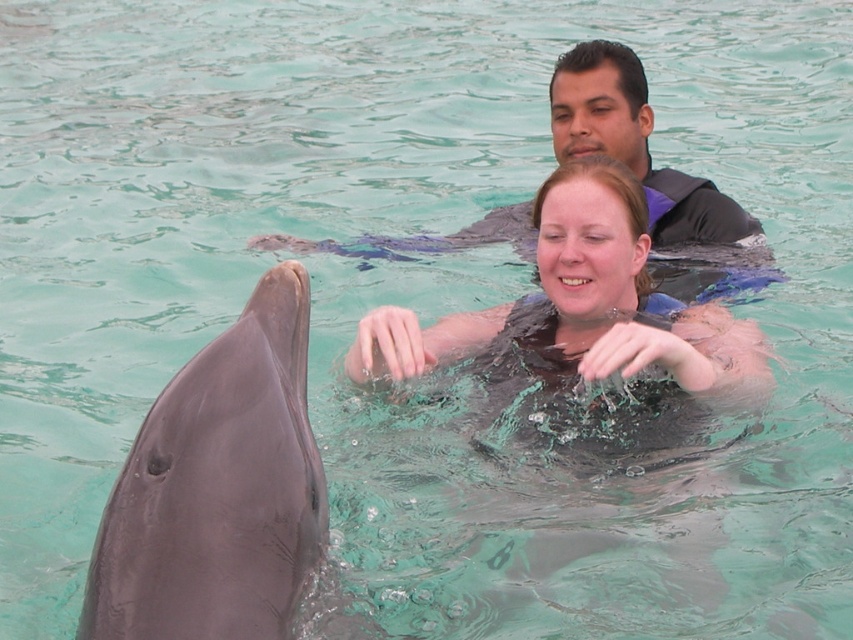
You are a photographer trying to capture the dolphin and the two people in the scene. You notice two specific points in the image at coordinates point (544,401) and point (587,67). Which of these points is closer to you as the photographer?

Point (544,401) is closer to the viewer than point (587,67).

You are a marine biologist observing the scene. You need to determine the relative sizes of the gray smooth dolphin at left and the black matte wetsuit at center. Which one is taller?

The gray smooth dolphin at left is shorter than the black matte wetsuit at center, so the black matte wetsuit at center is taller.

You are a photographer trying to capture the dolphin in the scene. There is a black matte wetsuit at center marked by point (585,330). Where should you position your camera to ensure the dolphin is in focus while avoiding the black matte wetsuit at center?

Position your camera so it focuses on the dolphin while avoiding the area marked by point (585,330) where the black matte wetsuit at center is located.